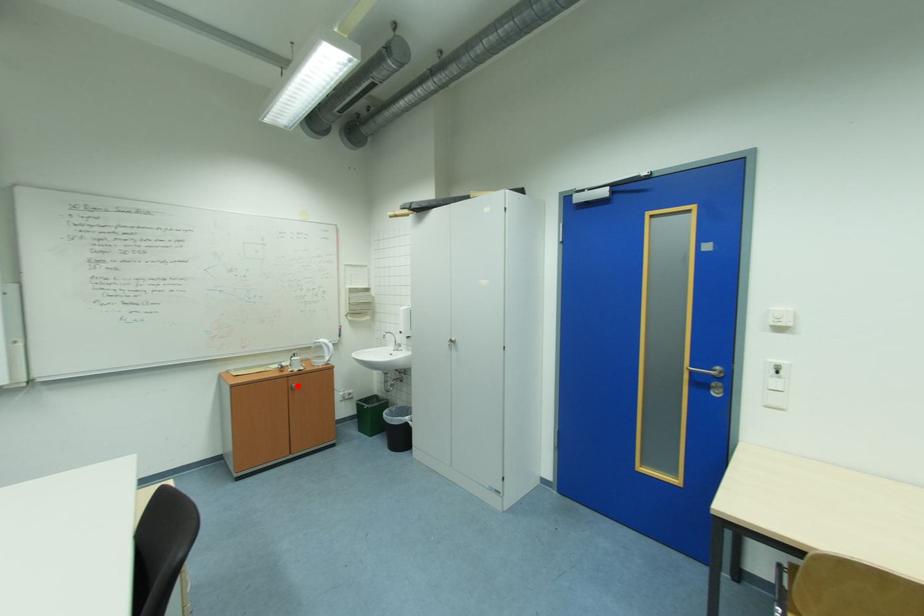
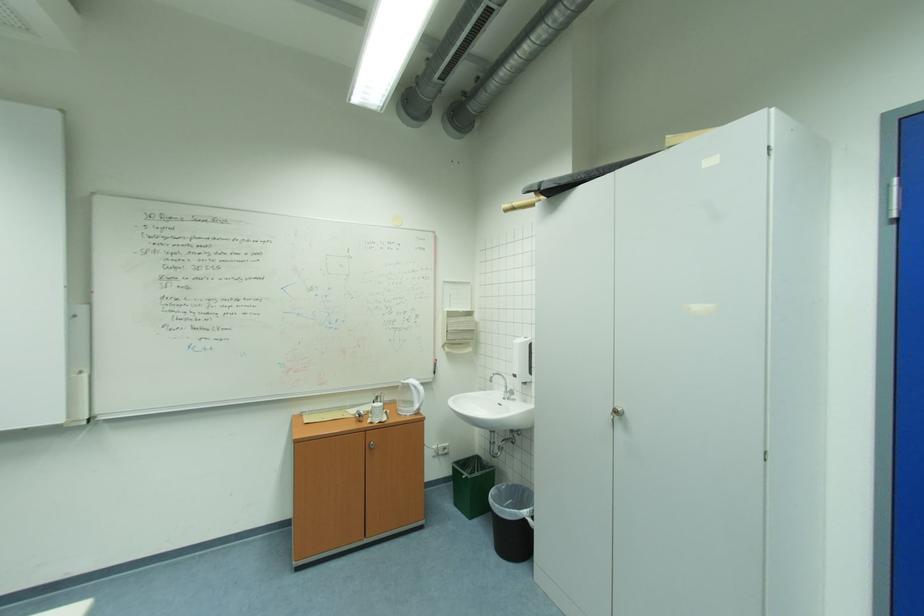
In the second image, find the point that corresponds to the highlighted location in the first image.

(375, 443)